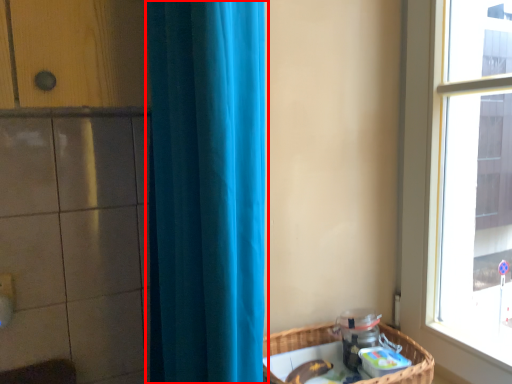
Question: Considering the relative positions of curtain (annotated by the red box) and basket in the image provided, where is curtain (annotated by the red box) located with respect to the staircase?

Choices:
 (A) right
 (B) left

Answer: (B)